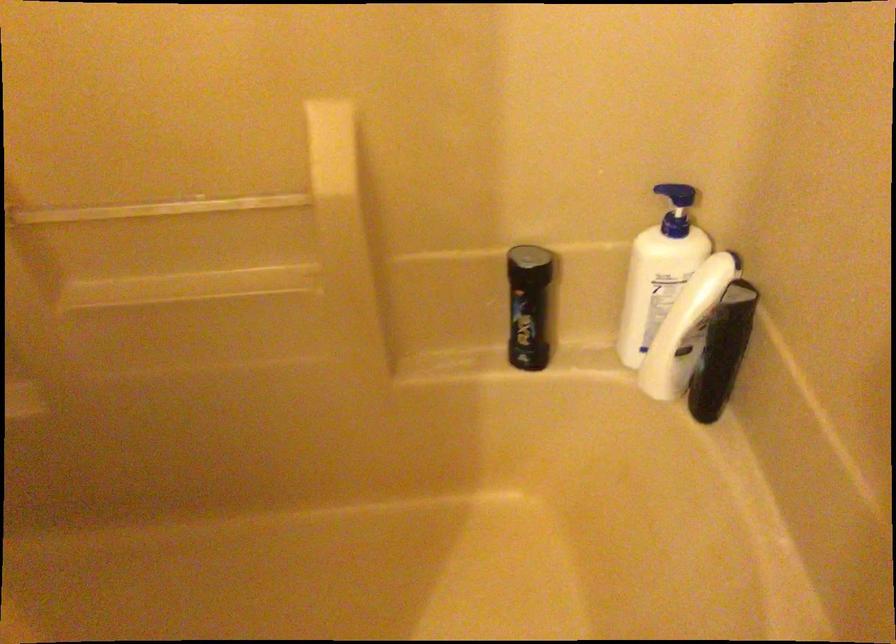
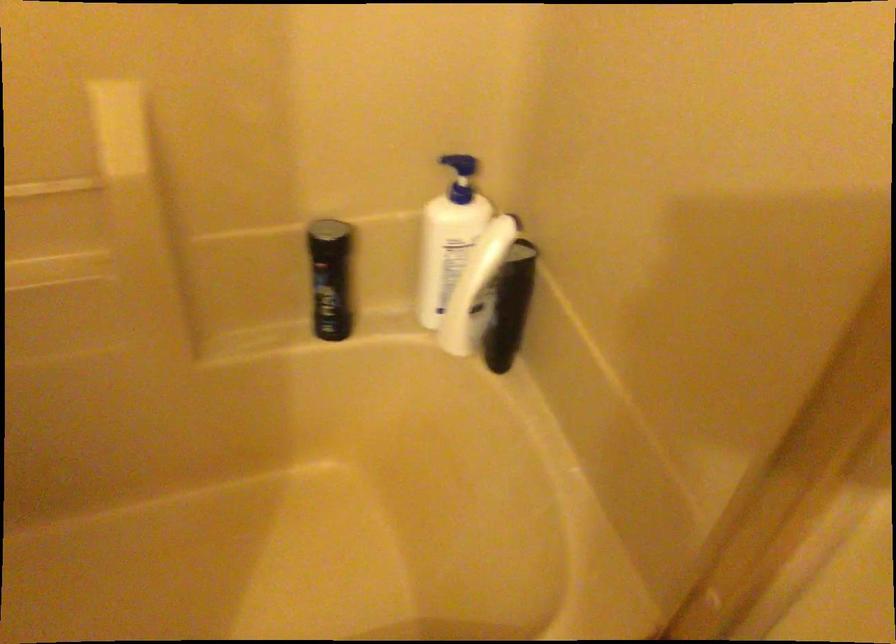
Locate, in the second image, the point that corresponds to the point at 528,306 in the first image.

(330, 278)